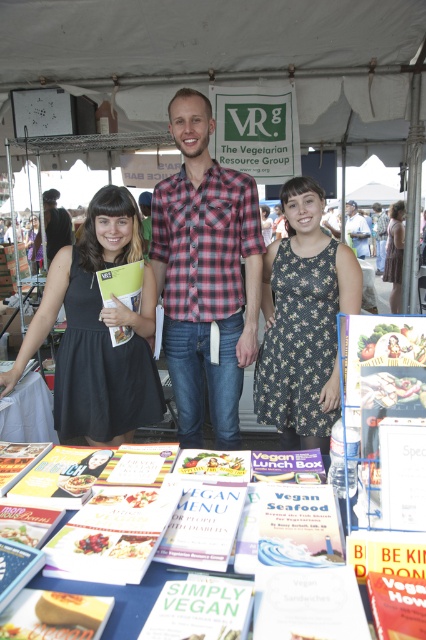
You are a photographer at the market fair and need to capture a photo of the black dress at left and the vegan lunch box at center. Which object should you focus on first if you want to highlight the larger item in your shot?

The black dress at left is larger in size than the vegan lunch box at center, so you should focus on the black dress at left first to highlight the larger item.

You are standing at the entrance of the market tent and want to walk towards the two points marked in the image. Which point, point (238, 465) or point (389, 218), will you reach first?

You will reach point (238, 465) first because it is closer to the viewer than point (389, 218).

You are a photographer at the market fair and want to take a photo of the matte black shirt at center and the white paper book at center. The camera can only focus on one object at a time. Which object should you focus on first to ensure it appears larger in the photo?

The matte black shirt at center is larger in size than the white paper book at center, so focusing on the matte black shirt at center first will ensure it appears larger in the photo.